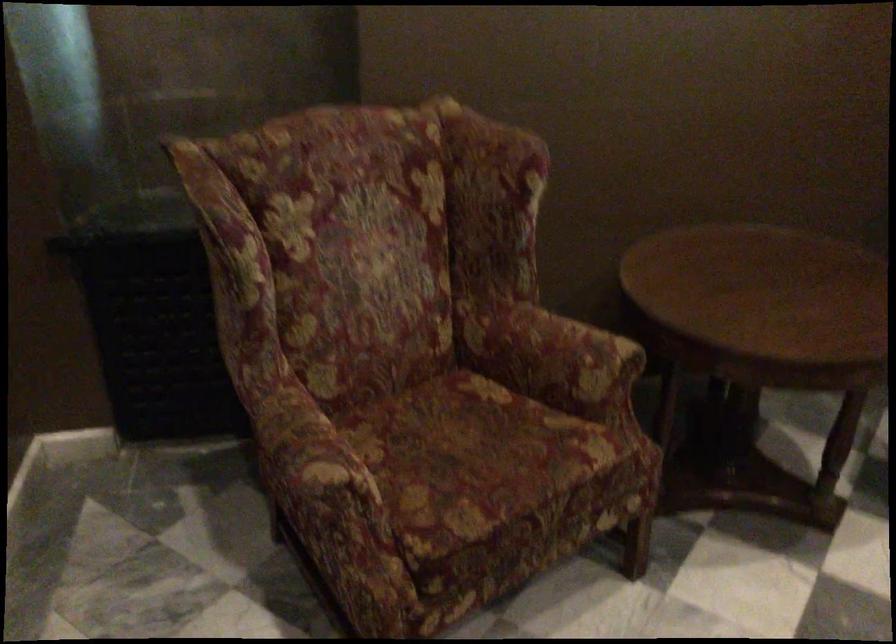
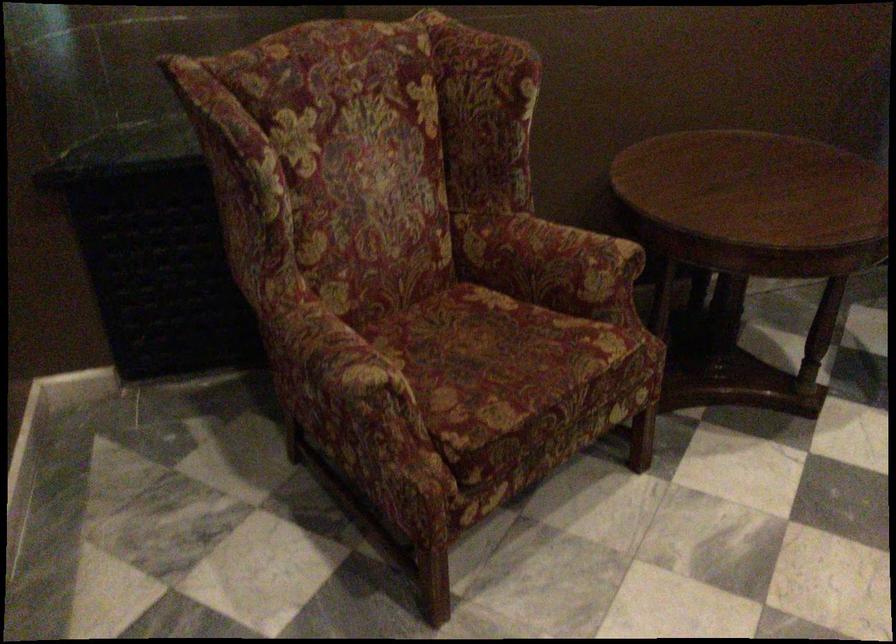
Find the pixel in the second image that matches point 302,486 in the first image.

(343, 389)